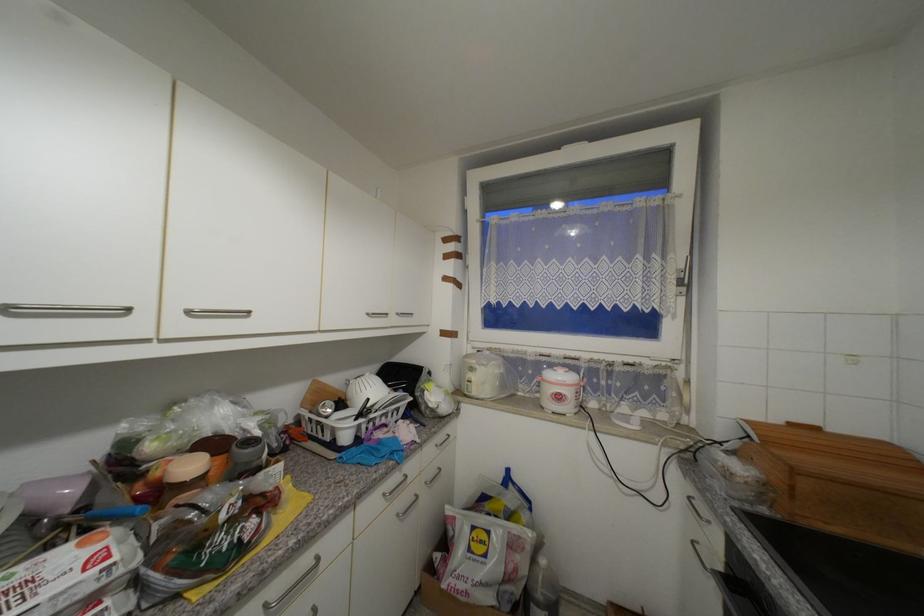
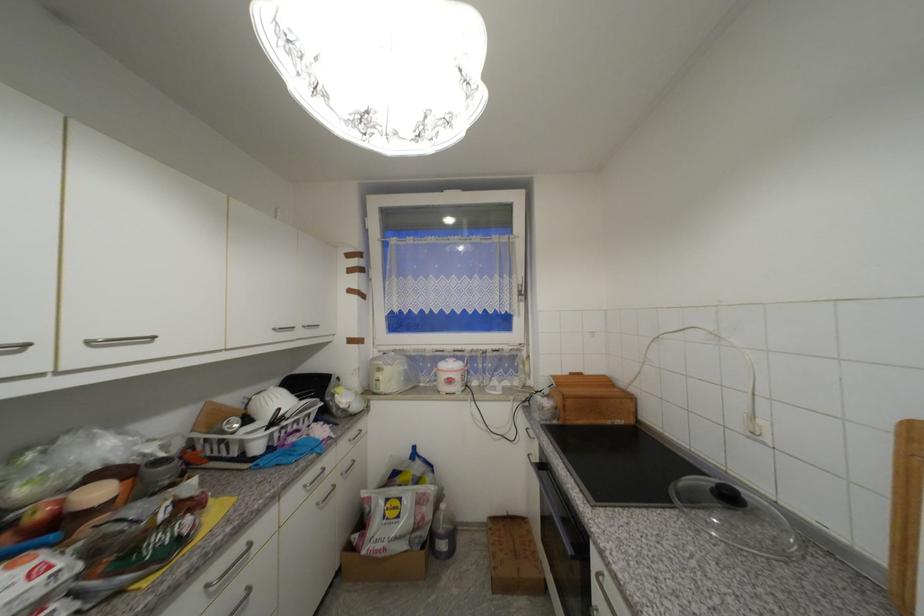
The point at (x=565, y=399) is marked in the first image. Where is the corresponding point in the second image?

(456, 382)